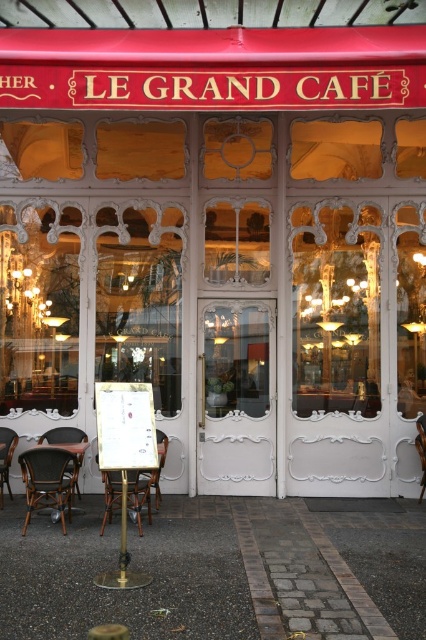
You are a customer waiting to sit at the brown woven chair at lower left and the brown wooden table at lower left. Which object is lower in height?

The brown woven chair at lower left is shorter than the brown wooden table at lower left, so the brown woven chair at lower left is lower in height.

You are standing at the entrance of Le Grand Cafe and want to walk to the point marked as point [0,486]. There is an obstacle at point [161,436]. Will you encounter this obstacle before reaching your destination?

Point [161,436] is behind point [0,486], so you will not encounter the obstacle at point [161,436] before reaching your destination.